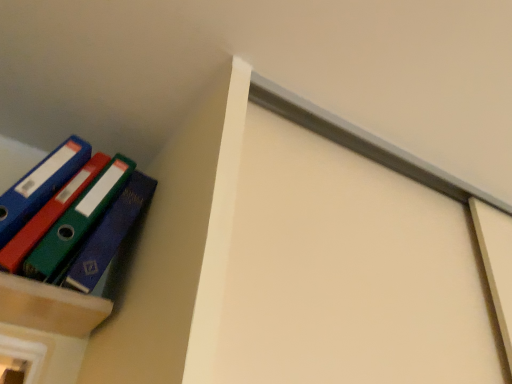
Measure the distance between point (53, 276) and camera.

33.23 inches.

This screenshot has height=384, width=512. Describe the element at coordinates (91, 229) in the screenshot. I see `matte plastic folders at upper left` at that location.

Find the location of `matte plastic folders at upper left`. matte plastic folders at upper left is located at coordinates (91, 229).

What is the approximate height of matte plastic folders at upper left?

matte plastic folders at upper left is 42.68 centimeters in height.

Image resolution: width=512 pixels, height=384 pixels. I want to click on matte plastic folders at upper left, so click(91, 229).